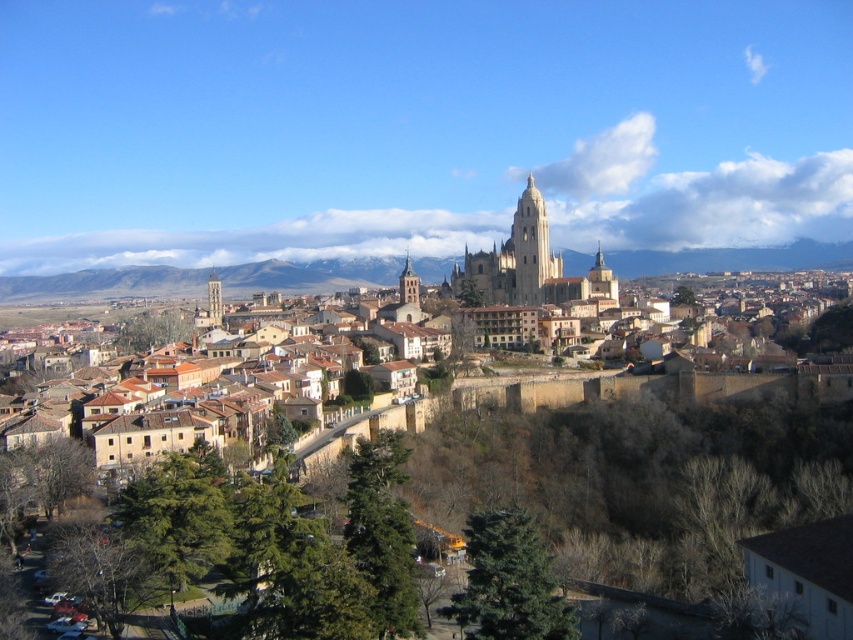
Question: Is brown stone town at center wider than gray stone cathedral at center?

Choices:
 (A) yes
 (B) no

Answer: (A)

Question: Among these objects, which one is farthest from the camera?

Choices:
 (A) gray stone cathedral at center
 (B) brown stone town at center

Answer: (A)

Question: Can you confirm if brown stone town at center is thinner than gray stone cathedral at center?

Choices:
 (A) yes
 (B) no

Answer: (B)

Question: Which point is farther from the camera taking this photo?

Choices:
 (A) (534, 200)
 (B) (686, 280)

Answer: (B)

Question: Can you confirm if brown stone town at center is positioned to the left of gray stone cathedral at center?

Choices:
 (A) yes
 (B) no

Answer: (A)